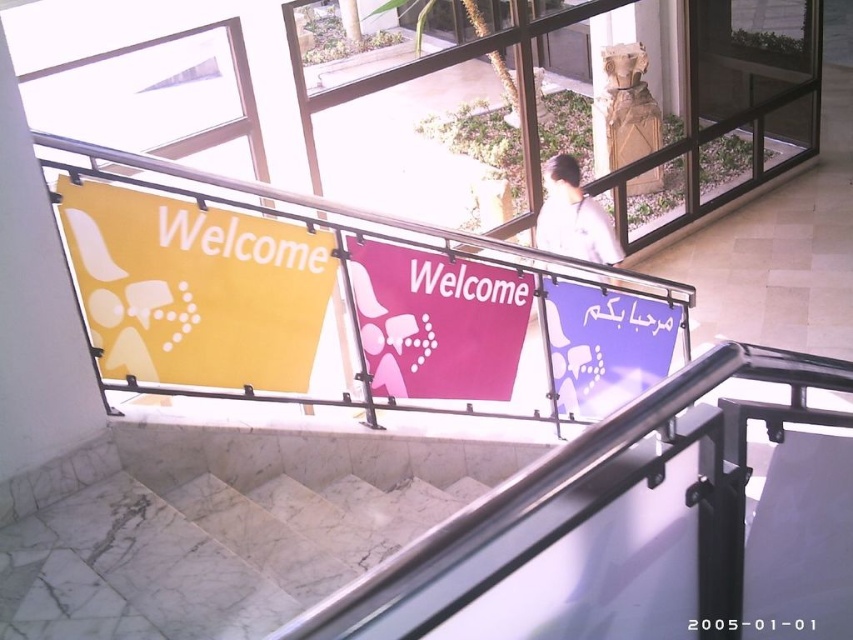
Question: Where is yellow matte sign at left located in relation to pink fabric sign at center in the image?

Choices:
 (A) below
 (B) above

Answer: (B)

Question: Which object is positioned farthest from the yellow matte sign at left?

Choices:
 (A) pink fabric sign at center
 (B) purple glossy sign at upper right

Answer: (B)

Question: Can you confirm if yellow matte sign at left is smaller than pink fabric sign at center?

Choices:
 (A) yes
 (B) no

Answer: (B)

Question: Which point is closer to the camera?

Choices:
 (A) purple glossy sign at upper right
 (B) yellow matte sign at left

Answer: (B)

Question: Considering the real-world distances, which object is farthest from the yellow matte sign at left?

Choices:
 (A) pink fabric sign at center
 (B) purple glossy sign at upper right

Answer: (B)

Question: Does yellow matte sign at left appear on the right side of pink fabric sign at center?

Choices:
 (A) yes
 (B) no

Answer: (B)